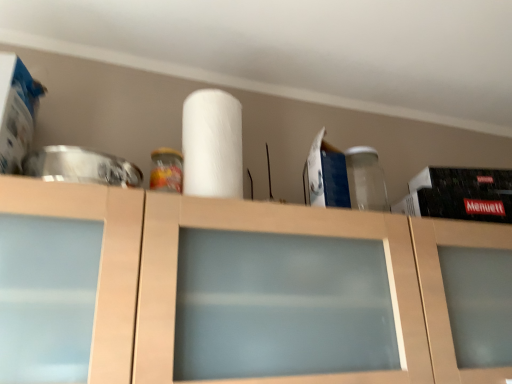
Question: Does white matte paper towel at center come in front of matte wood cabinet at center?

Choices:
 (A) yes
 (B) no

Answer: (B)

Question: Would you say matte wood cabinet at center is part of white matte paper towel at center's contents?

Choices:
 (A) yes
 (B) no

Answer: (B)

Question: From a real-world perspective, is white matte paper towel at center over matte wood cabinet at center?

Choices:
 (A) yes
 (B) no

Answer: (A)

Question: Is white matte paper towel at center behind matte wood cabinet at center?

Choices:
 (A) no
 (B) yes

Answer: (B)

Question: Does white matte paper towel at center appear on the left side of matte wood cabinet at center?

Choices:
 (A) no
 (B) yes

Answer: (B)

Question: Considering the relative sizes of white matte paper towel at center and matte wood cabinet at center in the image provided, is white matte paper towel at center shorter than matte wood cabinet at center?

Choices:
 (A) no
 (B) yes

Answer: (B)

Question: Can you confirm if matte wood cabinet at center is positioned to the left of white matte paper towel at center?

Choices:
 (A) no
 (B) yes

Answer: (A)

Question: Can you confirm if matte wood cabinet at center is wider than white matte paper towel at center?

Choices:
 (A) no
 (B) yes

Answer: (B)

Question: Does matte wood cabinet at center touch white matte paper towel at center?

Choices:
 (A) yes
 (B) no

Answer: (B)

Question: Can you confirm if matte wood cabinet at center is shorter than white matte paper towel at center?

Choices:
 (A) yes
 (B) no

Answer: (B)

Question: Is matte wood cabinet at center positioned in front of white matte paper towel at center?

Choices:
 (A) no
 (B) yes

Answer: (B)

Question: From a real-world perspective, is matte wood cabinet at center on white matte paper towel at center?

Choices:
 (A) yes
 (B) no

Answer: (B)

Question: Looking at the image, does matte wood cabinet at center seem bigger or smaller compared to white matte paper towel at center?

Choices:
 (A) small
 (B) big

Answer: (B)